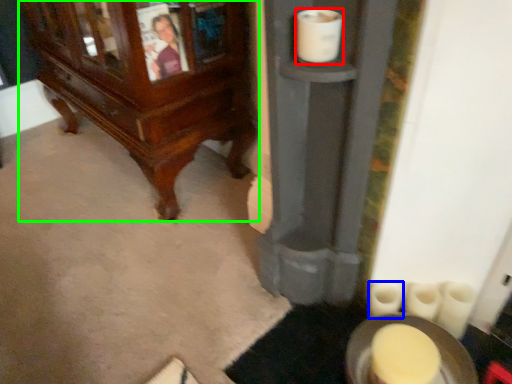
Question: Considering the real-world distances, which object is closest to toilet paper (highlighted by a red box)? toilet paper (highlighted by a blue box) or furniture (highlighted by a green box).

Choices:
 (A) toilet paper
 (B) furniture

Answer: (A)